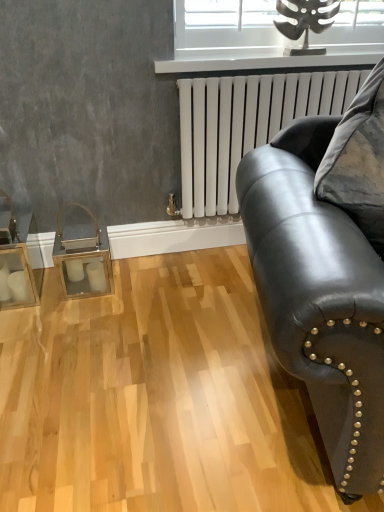
Question: From the image's perspective, is metallic silver window at upper center positioned above or below white matte radiator at upper right?

Choices:
 (A) below
 (B) above

Answer: (B)

Question: Looking at their shapes, would you say metallic silver window at upper center is wider or thinner than white matte radiator at upper right?

Choices:
 (A) thin
 (B) wide

Answer: (A)

Question: Considering the real-world distances, which object is farthest from the white glossy radiator at upper center?

Choices:
 (A) metallic silver window at upper center
 (B) black leather couch at right
 (C) white matte radiator at upper right

Answer: (B)

Question: Which object is the farthest from the white glossy radiator at upper center?

Choices:
 (A) metallic silver window at upper center
 (B) black leather couch at right
 (C) white matte radiator at upper right

Answer: (B)